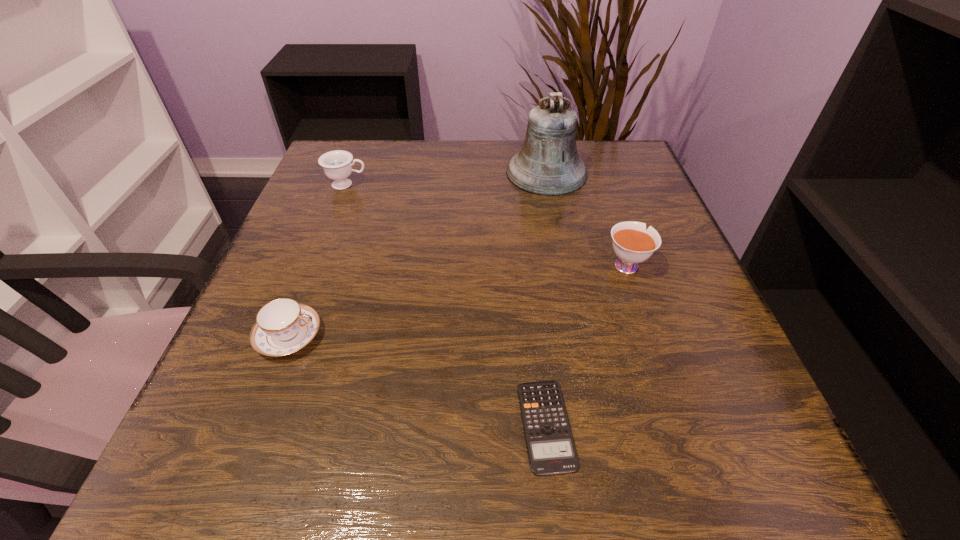
Identify the location of vacant space located on the side of the third farthest object with the handle. (604, 200).

The height and width of the screenshot is (540, 960). What are the coordinates of `blank space located on the side of the third farthest object with the handle` in the screenshot? It's located at (614, 231).

Where is `vacant space located on the side of the farthest teacup with the handle`? The height and width of the screenshot is (540, 960). vacant space located on the side of the farthest teacup with the handle is located at coordinates (528, 184).

At what (x,y) coordinates should I click in order to perform the action: click on free spot located on the side with the handle of the nearest teacup. Please return your answer as a coordinate pair (x, y). The width and height of the screenshot is (960, 540). Looking at the image, I should click on (544, 336).

I want to click on free region located on the back of the nearest object, so click(x=535, y=325).

Locate an element on the screen. bell that is at the far edge is located at coordinates (548, 164).

At what (x,y) coordinates should I click in order to perform the action: click on teacup that is positioned at the far edge. Please return your answer as a coordinate pair (x, y). The image size is (960, 540). Looking at the image, I should click on (337, 165).

Identify the location of object that is positioned at the near edge. Image resolution: width=960 pixels, height=540 pixels. (551, 449).

At what (x,y) coordinates should I click in order to perform the action: click on bell at the right edge. Please return your answer as a coordinate pair (x, y). Image resolution: width=960 pixels, height=540 pixels. Looking at the image, I should click on (548, 164).

The height and width of the screenshot is (540, 960). What are the coordinates of `teacup that is at the right edge` in the screenshot? It's located at (632, 243).